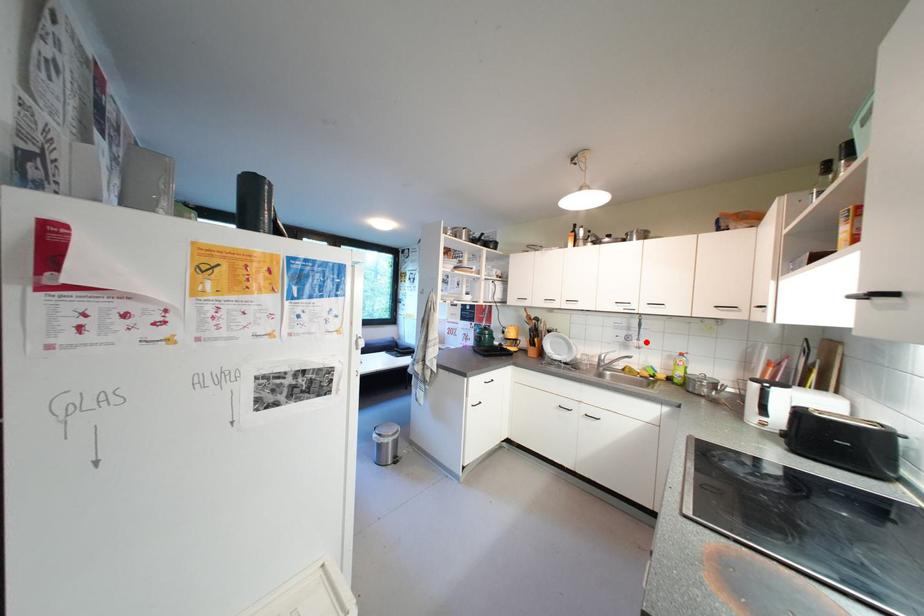
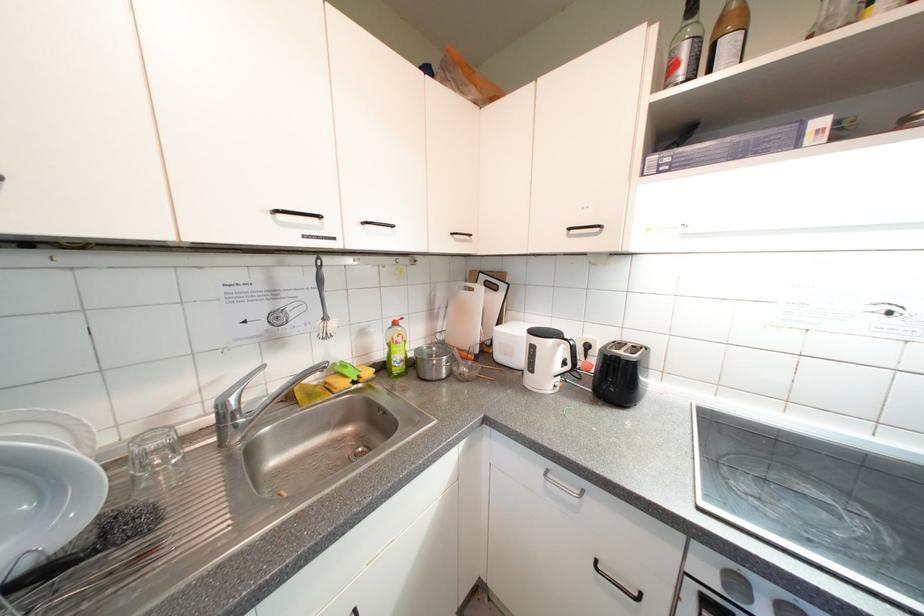
Where in the second image is the point corresponding to the highlighted location from the first image?

(333, 321)